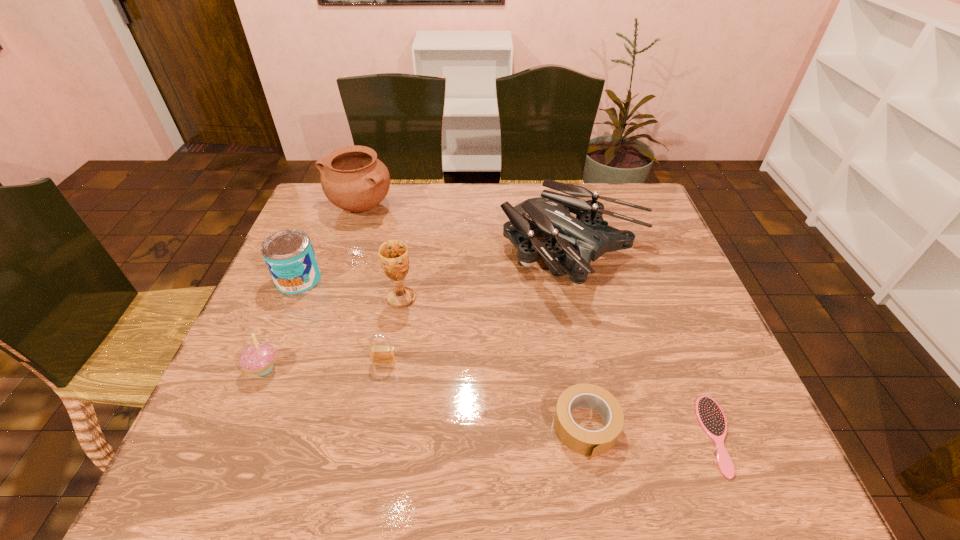
Locate an element on the screen. This screenshot has width=960, height=540. free space between the cupcake and the third shortest object is located at coordinates click(x=324, y=364).

This screenshot has height=540, width=960. Find the location of `object that is the fourth closest to the hairbrush`. object that is the fourth closest to the hairbrush is located at coordinates (393, 254).

Identify which object is the fifth nearest to the chalice. Please provide its 2D coordinates. Your answer should be formatted as a tuple, i.e. [(x, y)], where the tuple contains the x and y coordinates of a point satisfying the conditions above.

[(352, 178)]

The width and height of the screenshot is (960, 540). What are the coordinates of `vacant space that satisfies the following two spatial constraints: 1. on the back side of the cupcake; 2. on the right side of the chalice` in the screenshot? It's located at (294, 298).

This screenshot has height=540, width=960. In order to click on vacant space that satisfies the following two spatial constraints: 1. on the front side of the can; 2. on the left side of the chalice in this screenshot , I will do `click(291, 298)`.

Locate an element on the screen. This screenshot has width=960, height=540. vacant space that satisfies the following two spatial constraints: 1. at the edge of the hairbrush; 2. on the right side of the second shortest object is located at coordinates (588, 435).

Locate an element on the screen. vacant space that satisfies the following two spatial constraints: 1. on the back side of the drone; 2. on the left side of the can is located at coordinates (309, 256).